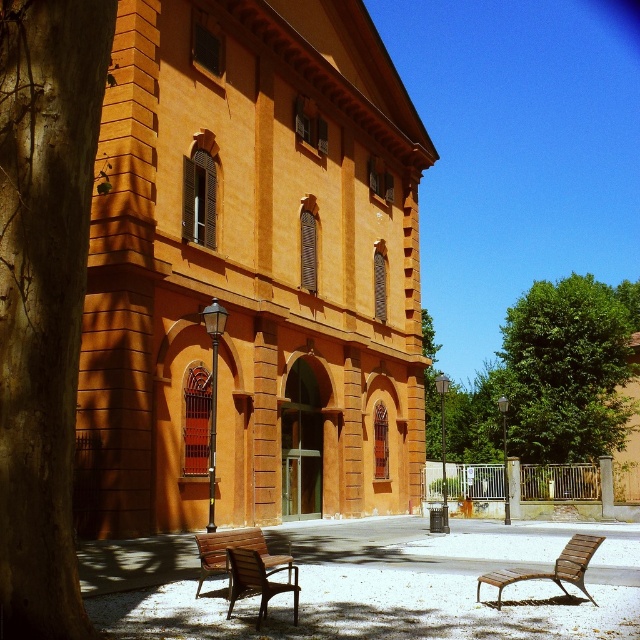
You are planning to sit on the wooden park bench at lower left to enjoy the view of the green leafy tree at center. Considering their sizes, do you think the tree will block your view of the building behind it?

The green leafy tree at center is much taller than the wooden park bench at lower left, so the tree might block your view of the building behind it.

You are planning to place a new bench in the paved area in front of the building. The existing benches are already positioned, and you need to ensure there is enough space between the smooth brown tree trunk at left and the brown wooden chair at lower center to accommodate the new bench. Can you determine if the space between them is sufficient?

The smooth brown tree trunk at left is larger in size than the brown wooden chair at lower center, but the description does not provide specific measurements of the distance between them. Therefore, it is unclear if there is enough space to place the new bench between them.

You are standing at the entrance of the orange building and want to sit on the brown wooden bench at lower right. Which direction should you walk to reach it from the green leafy tree at center?

To reach the brown wooden bench at lower right from the green leafy tree at center, you should walk to the left since the green leafy tree at center is to the right of the brown wooden bench at lower right.